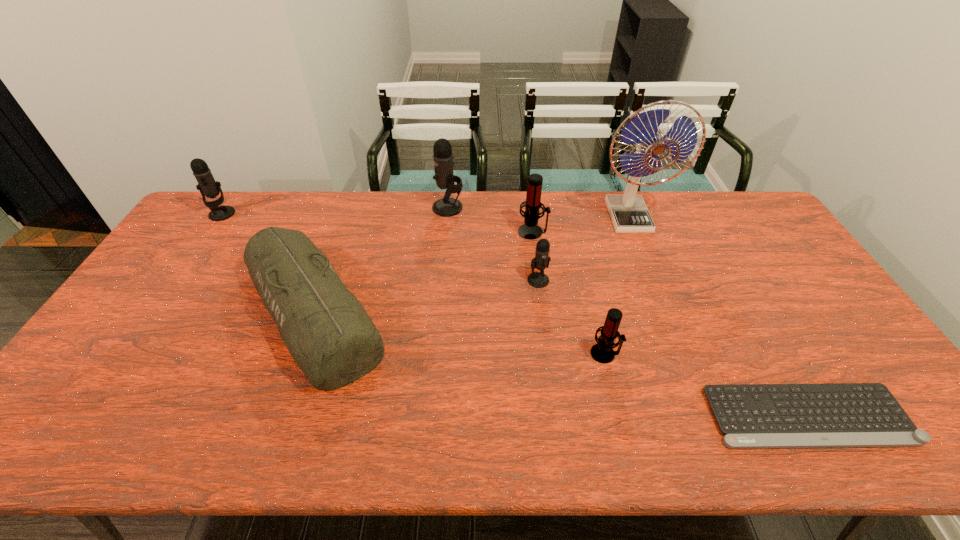
Where is `free space between the second object from left to right and the right red microphone`? The height and width of the screenshot is (540, 960). free space between the second object from left to right and the right red microphone is located at coordinates point(459,333).

Locate an element on the screen. The height and width of the screenshot is (540, 960). object that stands as the fifth closest to the bigger red microphone is located at coordinates (602, 352).

Choose which object is the fourth nearest neighbor to the second black microphone from right to left. Please provide its 2D coordinates. Your answer should be formatted as a tuple, i.e. [(x, y)], where the tuple contains the x and y coordinates of a point satisfying the conditions above.

[(629, 214)]

Where is `microphone identified as the second closest to the tallest object`? microphone identified as the second closest to the tallest object is located at coordinates tap(541, 261).

Select which microphone is the third closest to the blue fan. Please provide its 2D coordinates. Your answer should be formatted as a tuple, i.e. [(x, y)], where the tuple contains the x and y coordinates of a point satisfying the conditions above.

[(602, 352)]

You are a GUI agent. You are given a task and a screenshot of the screen. Output one action in this format:
    pyautogui.click(x=<x>, y=<y>)
    Task: Click on the black microphone that is the third closest to the fan
    
    Given the screenshot: What is the action you would take?
    pyautogui.click(x=208, y=187)

Identify the location of the closest black microphone relative to the bigger red microphone. (541, 261).

In order to click on free space that satisfies the following two spatial constraints: 1. on the front side of the right red microphone; 2. on the left side of the olive duffel bag in this screenshot , I will do `click(300, 354)`.

You are a GUI agent. You are given a task and a screenshot of the screen. Output one action in this format:
    pyautogui.click(x=<x>, y=<y>)
    Task: Click on the vacant space that satisfies the following two spatial constraints: 1. on the back side of the second nearest microphone; 2. on the right side of the left red microphone
    Image resolution: width=960 pixels, height=540 pixels.
    Given the screenshot: What is the action you would take?
    pyautogui.click(x=532, y=232)

Find the location of a particular element. This screenshot has width=960, height=540. free space in the image that satisfies the following two spatial constraints: 1. on the front side of the nearest microphone; 2. on the right side of the leftmost black microphone is located at coordinates point(127,354).